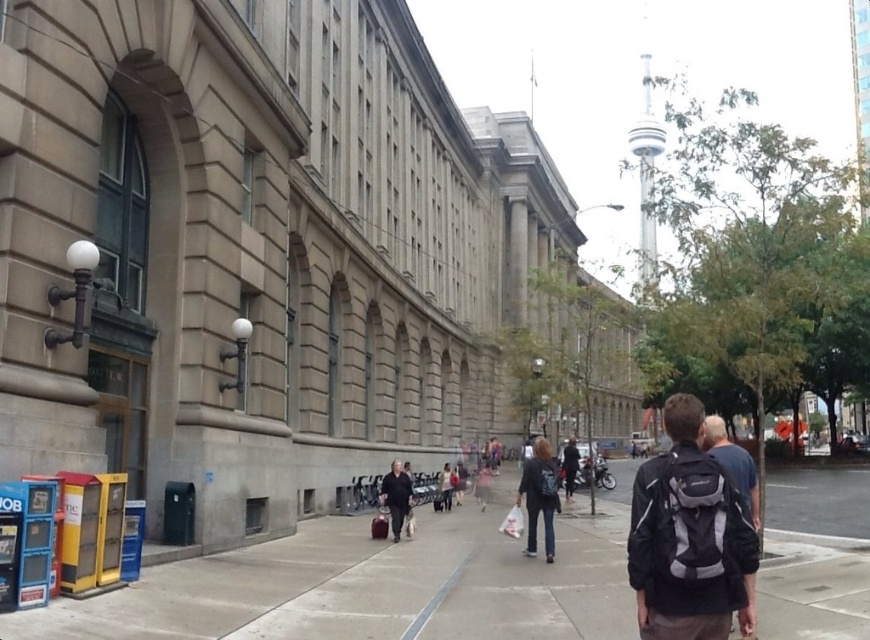
You are a delivery person standing on the gray concrete sidewalk at center. You need to hand a package to the person wearing the dark gray fabric jacket at center. Can you reach them without leaving the sidewalk?

The gray concrete sidewalk at center is below dark gray fabric jacket at center, so yes, you can reach them while staying on the sidewalk since the jacket is at the same level as the sidewalk.

You are a delivery person standing on the gray concrete sidewalk at center and need to place the dark blue backpack at center on a shelf that can only hold items shorter than the sidewalk. Will the backpack fit?

The gray concrete sidewalk at center is shorter than the dark blue backpack at center, so the backpack is taller than the sidewalk. Since the shelf can only hold items shorter than the sidewalk, the dark blue backpack at center will not fit on the shelf.

You are standing at the point with coordinates point [186,579] and want to walk to the point with coordinates point [728,465]. Which direction should you move to reach your destination?

To reach point [728,465] from point [186,579], you should move towards the direction where the coordinates decrease in the x and y axes, as point [728,465] is located behind point [186,579].